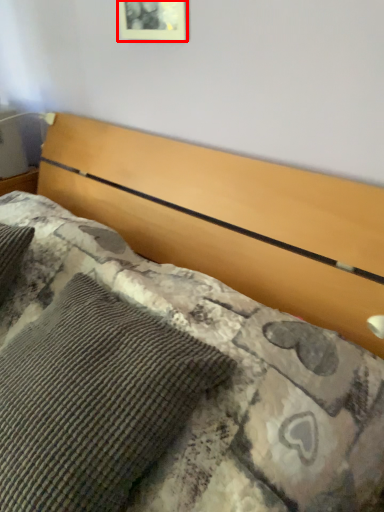
Question: In this image, where is picture frame (annotated by the red box) located relative to pillow?

Choices:
 (A) right
 (B) left

Answer: (A)